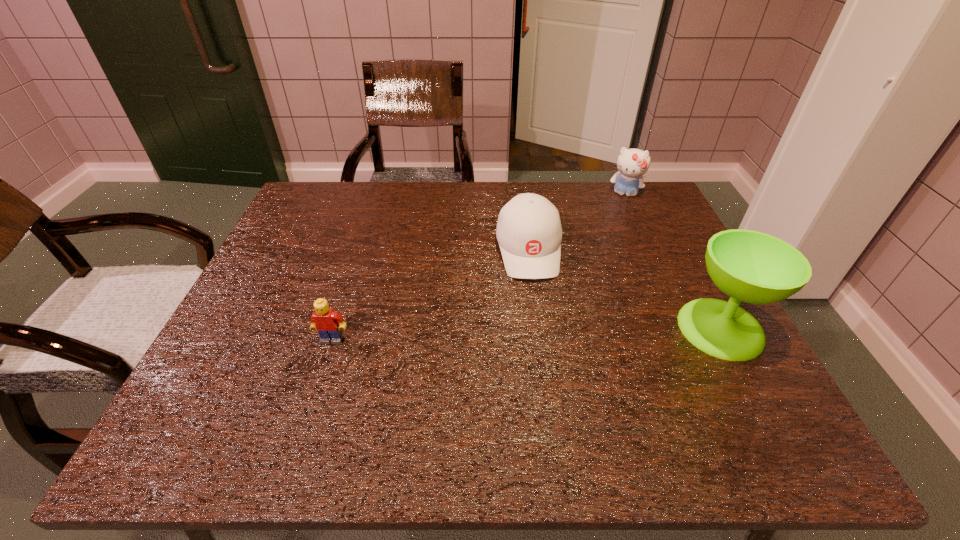
Image resolution: width=960 pixels, height=540 pixels. I want to click on free region at the left edge of the desktop, so click(306, 276).

You are a GUI agent. You are given a task and a screenshot of the screen. Output one action in this format:
    pyautogui.click(x=<x>, y=<y>)
    Task: Click on the vacant space at the right edge
    This screenshot has height=540, width=960.
    Given the screenshot: What is the action you would take?
    pyautogui.click(x=657, y=228)

In order to click on vacant space at the far left corner of the desktop in this screenshot , I will do `click(345, 217)`.

What are the coordinates of `free spot at the far right corner of the desktop` in the screenshot? It's located at coord(629,206).

Image resolution: width=960 pixels, height=540 pixels. In order to click on vacant area between the tallest object and the second object from left to right in this screenshot , I will do `click(625, 289)`.

Locate an element on the screen. free spot between the baseball cap and the Lego is located at coordinates (430, 295).

You are a GUI agent. You are given a task and a screenshot of the screen. Output one action in this format:
    pyautogui.click(x=<x>, y=<y>)
    Task: Click on the free area in between the Lego and the kitten
    
    Given the screenshot: What is the action you would take?
    pyautogui.click(x=478, y=267)

Where is `free space between the third object from right to left and the tallest object`? Image resolution: width=960 pixels, height=540 pixels. free space between the third object from right to left and the tallest object is located at coordinates pos(625,289).

Find the location of a particular element. The image size is (960, 540). vacant area that lies between the farthest object and the leftmost object is located at coordinates (478, 267).

At what (x,y) coordinates should I click in order to perform the action: click on free point between the farthest object and the leftmost object. Please return your answer as a coordinate pair (x, y). This screenshot has height=540, width=960. Looking at the image, I should click on (478, 267).